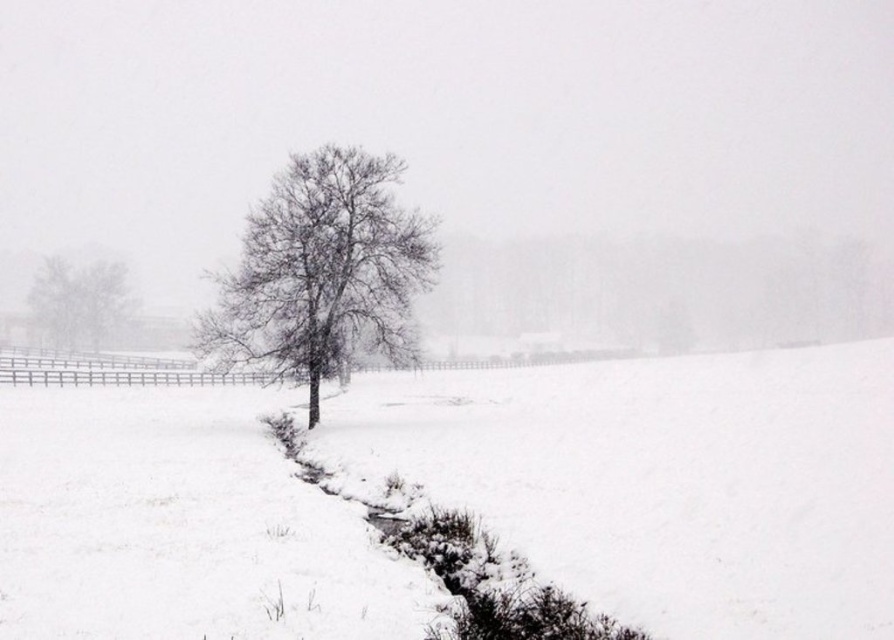
Question: Observing the image, what is the correct spatial positioning of snowy dirt trench at lower center in reference to bare branches at left?

Choices:
 (A) right
 (B) left

Answer: (A)

Question: Among these objects, which one is farthest from the camera?

Choices:
 (A) bare branches at center
 (B) snowy dirt trench at lower center

Answer: (A)

Question: Which object is positioned closest to the bare branches at left?

Choices:
 (A) bare branches at center
 (B) snowy dirt trench at lower center

Answer: (A)

Question: Is bare branches at center smaller than bare branches at left?

Choices:
 (A) no
 (B) yes

Answer: (A)

Question: Estimate the real-world distances between objects in this image. Which object is closer to the bare branches at center?

Choices:
 (A) white fluffy snow at center
 (B) snowy dirt trench at lower center

Answer: (A)

Question: Can you confirm if white fluffy snow at center is positioned above bare branches at center?

Choices:
 (A) yes
 (B) no

Answer: (B)